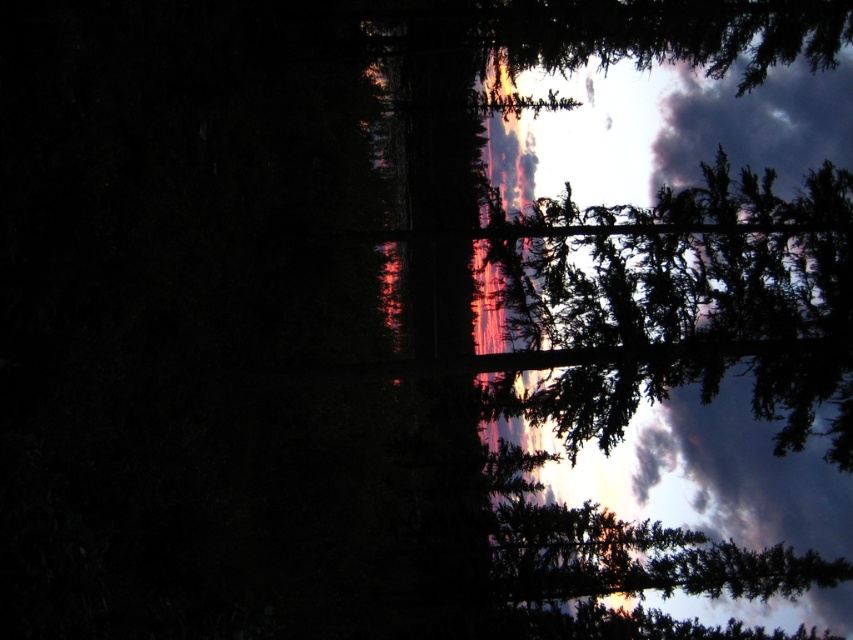
You are an artist sketching this sunset scene. You want to ensure the green textured tree at upper right and the green matte tree at upper center are positioned correctly in terms of depth. Which tree should you draw in front of the other?

The green textured tree at upper right should be drawn in front of the green matte tree at upper center because it is closer to the viewer.